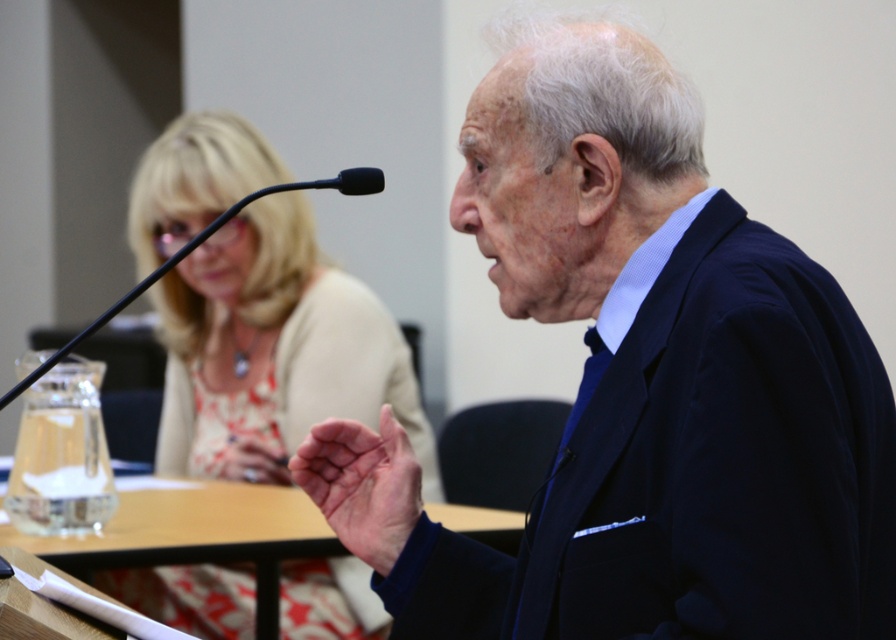
Question: Which point appears farthest from the camera in this image?

Choices:
 (A) (750, 588)
 (B) (263, 230)
 (C) (390, 566)
 (D) (309, 532)

Answer: (B)

Question: Which of these objects is positioned farthest from the matte beige blouse at upper left?

Choices:
 (A) blue fabric suit at center
 (B) pink skin at center

Answer: (A)

Question: Does blue fabric suit at center appear on the left side of matte beige blouse at upper left?

Choices:
 (A) yes
 (B) no

Answer: (B)

Question: Is matte beige blouse at upper left to the right of clear glass table at center from the viewer's perspective?

Choices:
 (A) no
 (B) yes

Answer: (A)

Question: Can you confirm if matte beige blouse at upper left is positioned below clear glass table at center?

Choices:
 (A) yes
 (B) no

Answer: (B)

Question: Which point is farther to the camera?

Choices:
 (A) (782, 369)
 (B) (359, 522)
 (C) (4, 540)
 (D) (227, 259)

Answer: (D)